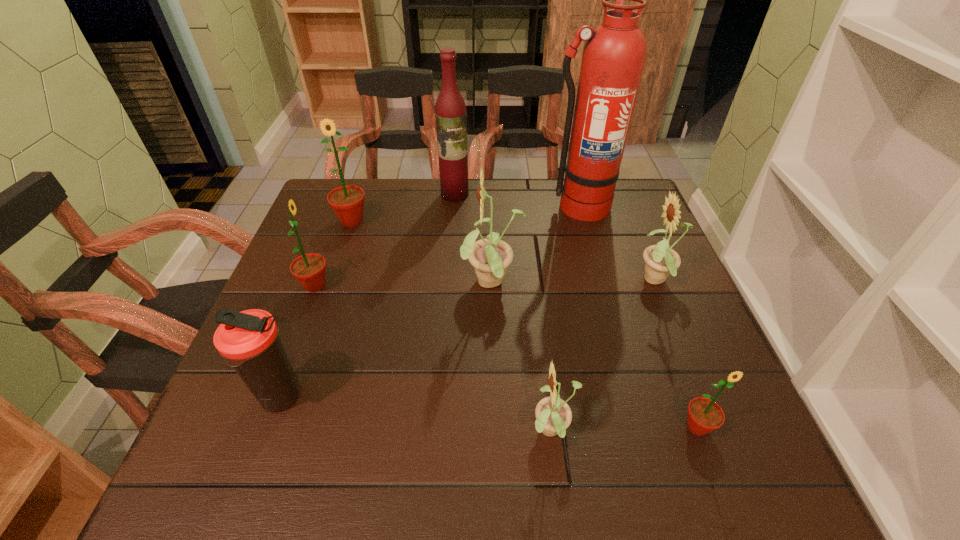
The image size is (960, 540). In order to click on the tallest object in this screenshot , I will do `click(614, 55)`.

The width and height of the screenshot is (960, 540). Identify the location of dark liquor. (450, 109).

Locate an element on the screen. Image resolution: width=960 pixels, height=540 pixels. the second tallest object is located at coordinates (450, 109).

Locate an element on the screen. the biggest yellow sunflower is located at coordinates (490, 257).

In order to click on the farthest green sunflower in this screenshot , I will do `click(347, 202)`.

This screenshot has width=960, height=540. I want to click on the biggest green sunflower, so click(347, 202).

Identify the location of the second smallest yellow sunflower. The width and height of the screenshot is (960, 540). (660, 260).

Image resolution: width=960 pixels, height=540 pixels. What are the coordinates of `the second smallest green sunflower` in the screenshot? It's located at (309, 269).

Locate an element on the screen. The height and width of the screenshot is (540, 960). brown thermos bottle is located at coordinates (248, 340).

Image resolution: width=960 pixels, height=540 pixels. In order to click on the nearest yellow sunflower in this screenshot , I will do `click(553, 415)`.